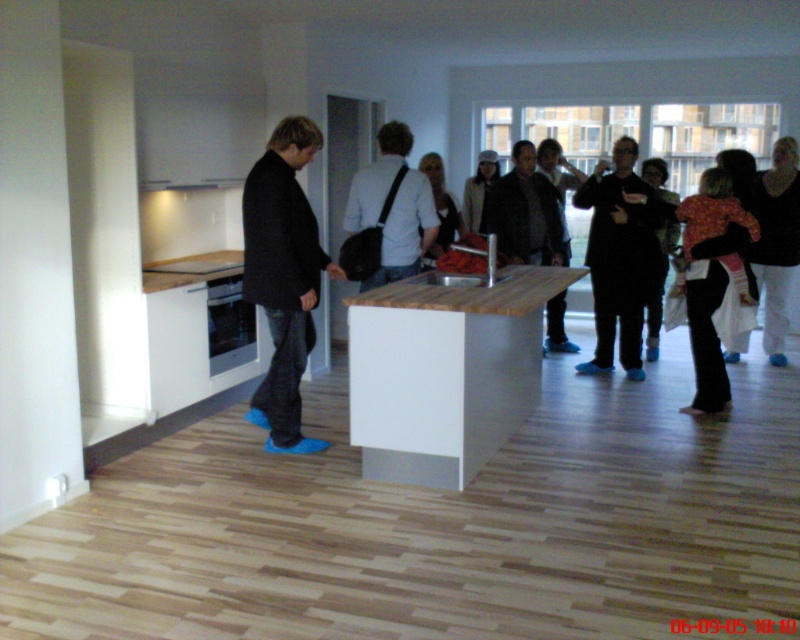
Question: Which is farther from the dark brown leather jacket at center?

Choices:
 (A) white matte shirt at center
 (B) dark wool coat at left
 (C) white textured jacket at center

Answer: (B)

Question: Does dark brown leather jacket at center come in front of white textured jacket at center?

Choices:
 (A) yes
 (B) no

Answer: (A)

Question: Is black matte coat at center positioned in front of white matte shirt at center?

Choices:
 (A) no
 (B) yes

Answer: (A)

Question: Which point is closer to the camera?

Choices:
 (A) white textured jacket at center
 (B) black matte coat at center
 (C) white matte shirt at center

Answer: (C)

Question: Does floral fabric dress at right have a smaller size compared to dark brown leather jacket at center?

Choices:
 (A) no
 (B) yes

Answer: (B)

Question: Which of the following is the farthest from the observer?

Choices:
 (A) (480, 216)
 (B) (624, 307)

Answer: (A)